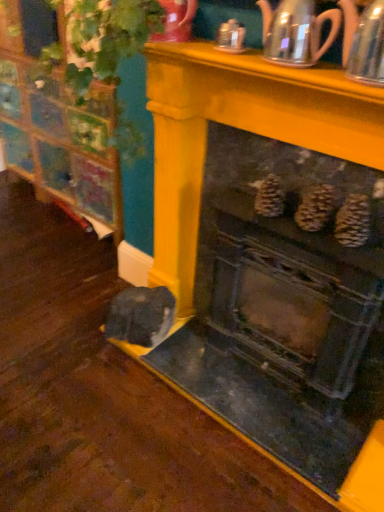
Question: Relative to clear glass teapot at upper center, the first tea pot in the left-to-right sequence, is metallic silver teapot at upper right, the 1th tea pot viewed from the right, in front or behind?

Choices:
 (A) behind
 (B) front

Answer: (B)

Question: Is point (369, 18) closer or farther from the camera than point (269, 39)?

Choices:
 (A) farther
 (B) closer

Answer: (B)

Question: Which object is positioned closest to the wooden cabinet at left?

Choices:
 (A) clear glass teapot at upper center, which appears as the second tea pot when viewed from the right
 (B) metallic silver teapot at upper right, acting as the 2th tea pot starting from the left
 (C) metallic gray fireplace at center

Answer: (C)

Question: Which object is positioned farthest from the clear glass teapot at upper center, which appears as the second tea pot when viewed from the right?

Choices:
 (A) metallic gray fireplace at center
 (B) metallic silver teapot at upper right, acting as the 2th tea pot starting from the left
 (C) wooden cabinet at left

Answer: (C)